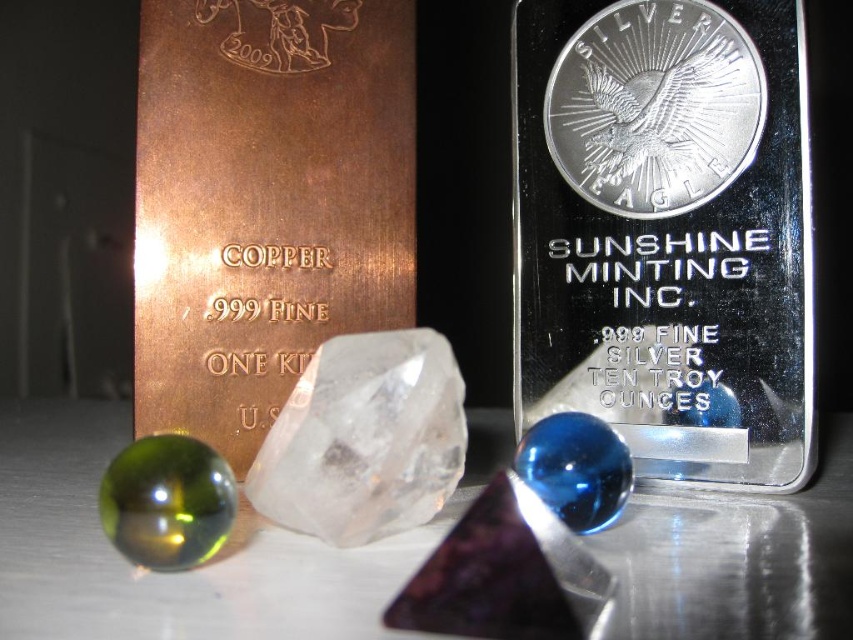
Can you confirm if silver/metallic coin at center is smaller than transparent crystal at center?

Actually, silver/metallic coin at center might be larger than transparent crystal at center.

Does silver/metallic coin at center have a greater width compared to transparent crystal at center?

Correct, the width of silver/metallic coin at center exceeds that of transparent crystal at center.

At what (x,y) coordinates should I click in order to perform the action: click on silver/metallic coin at center. Please return your answer as a coordinate pair (x, y). The height and width of the screenshot is (640, 853). Looking at the image, I should click on (654, 106).

Locate an element on the screen. This screenshot has width=853, height=640. silver/metallic coin at center is located at coordinates (654, 106).